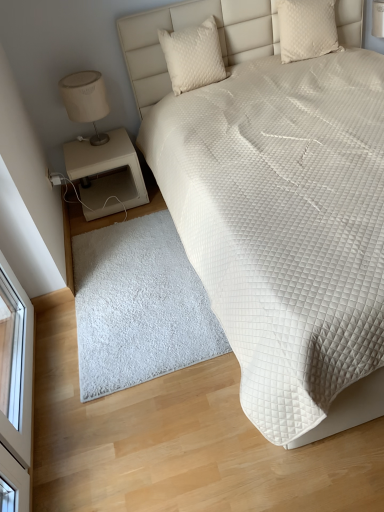
The image size is (384, 512). I want to click on vacant space situated above beige matte nightstand at lower left (from a real-world perspective), so click(86, 141).